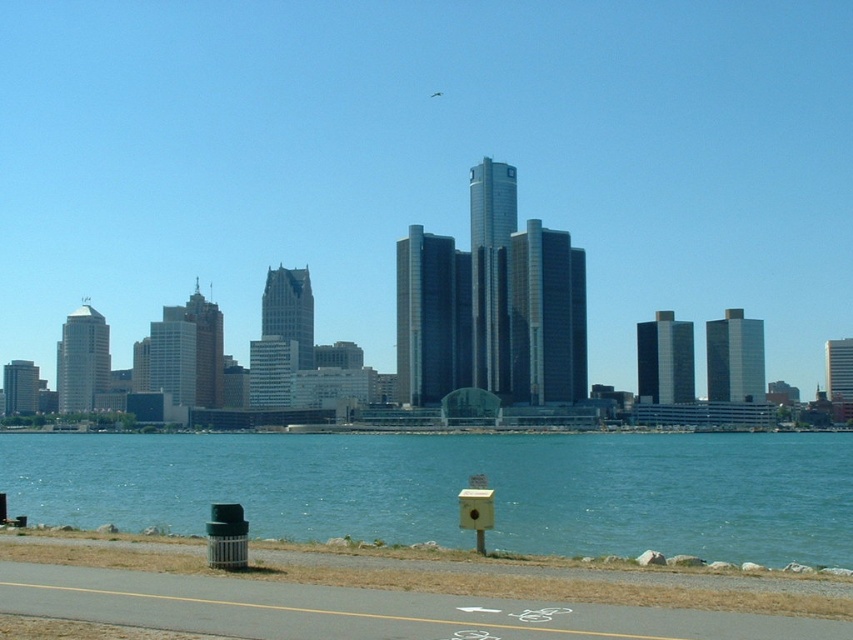
You are standing on the gray asphalt bike path at lower center and want to reach the blue water at lower center. Which direction should you move to get there?

The blue water at lower center is to the right of the gray asphalt bike path at lower center, so you should move to the right to reach it.

You are a city planner analyzing the image of the waterfront area. You need to determine which area occupies more space between the blue water at lower center and the gray asphalt bike path at lower center. Which one is larger?

The blue water at lower center is larger in size than the gray asphalt bike path at lower center according to the description.